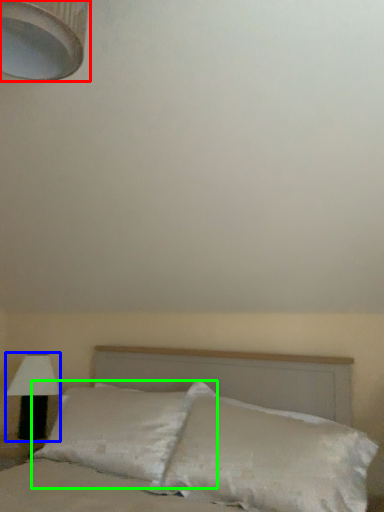
Question: Based on their relative distances, which object is farther from lamp (highlighted by a red box)? Choose from lamp (highlighted by a blue box) and pillow (highlighted by a green box).

Choices:
 (A) lamp
 (B) pillow

Answer: (A)